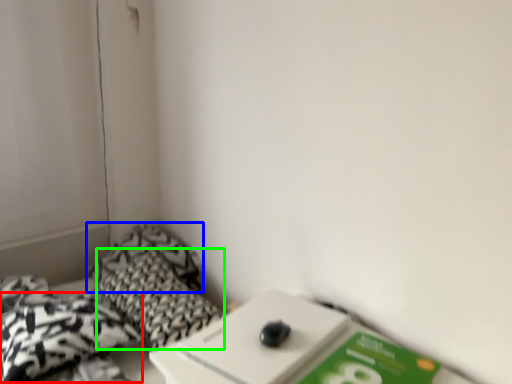
Question: Which object is the farthest from throw pillow (highlighted by a red box)? Choose among these: pillow (highlighted by a blue box) or pillow (highlighted by a green box).

Choices:
 (A) pillow
 (B) pillow

Answer: (A)